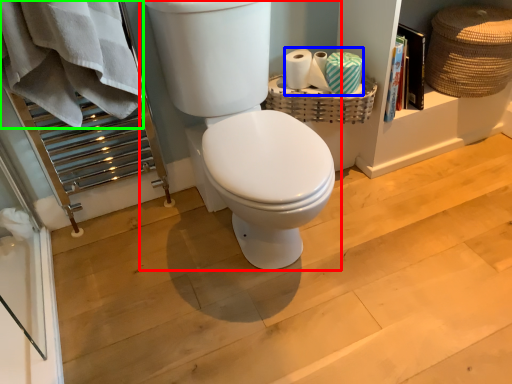
Question: Which object is positioned farthest from toilet (highlighted by a red box)? Select from toilet paper (highlighted by a blue box) and bath towel (highlighted by a green box).

Choices:
 (A) toilet paper
 (B) bath towel

Answer: (A)